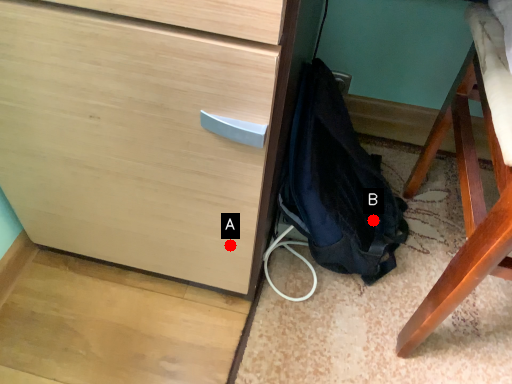
Question: Two points are circled on the image, labeled by A and B beside each circle. Which point is closer to the camera?

Choices:
 (A) A is closer
 (B) B is closer

Answer: (A)